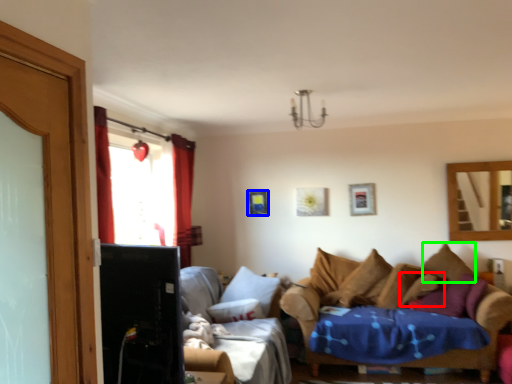
Question: Considering the real-world distances, which object is farthest from pillow (highlighted by a red box)? picture frame (highlighted by a blue box) or pillow (highlighted by a green box)?

Choices:
 (A) picture frame
 (B) pillow

Answer: (A)